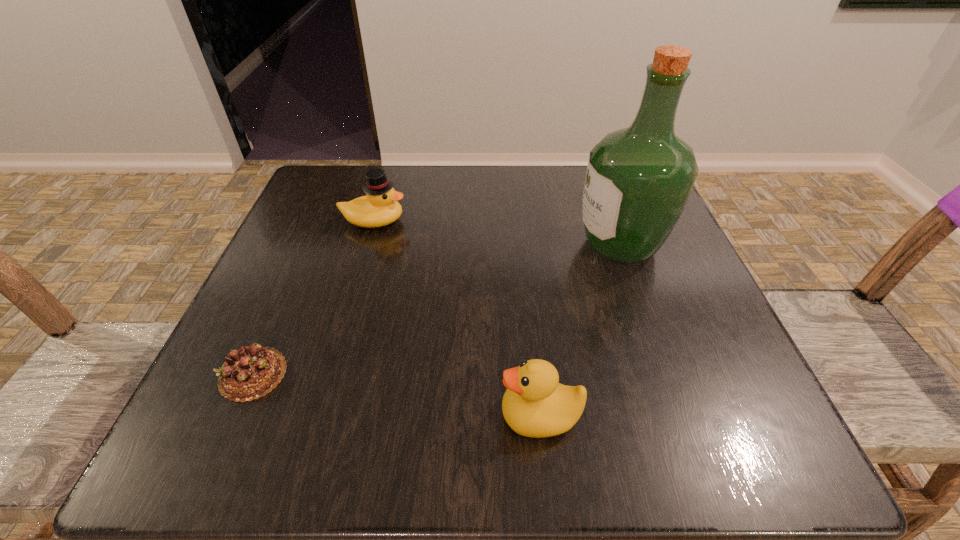
At what (x,y) coordinates should I click in order to perform the action: click on object located at the right edge. Please return your answer as a coordinate pair (x, y). Image resolution: width=960 pixels, height=540 pixels. Looking at the image, I should click on (638, 180).

Identify the location of object that is at the far left corner. (380, 207).

Identify the location of object present at the near left corner. (251, 372).

You are a GUI agent. You are given a task and a screenshot of the screen. Output one action in this format:
    pyautogui.click(x=<x>, y=<y>)
    Task: Click on the object that is at the far right corner
    This screenshot has width=960, height=540.
    Given the screenshot: What is the action you would take?
    pyautogui.click(x=638, y=180)

Locate an element on the screen. Image resolution: width=960 pixels, height=540 pixels. free spot at the far edge of the desktop is located at coordinates (535, 172).

Find the location of a particular element. The image size is (960, 540). vacant space at the near edge of the desktop is located at coordinates (641, 424).

The height and width of the screenshot is (540, 960). I want to click on blank space at the left edge, so click(322, 233).

This screenshot has width=960, height=540. Find the location of `vacant region at the right edge`. vacant region at the right edge is located at coordinates (641, 318).

Identify the location of free region at the far left corner of the desktop. The width and height of the screenshot is (960, 540). (337, 198).

The width and height of the screenshot is (960, 540). What are the coordinates of `vacant space at the near left corner` in the screenshot? It's located at (275, 436).